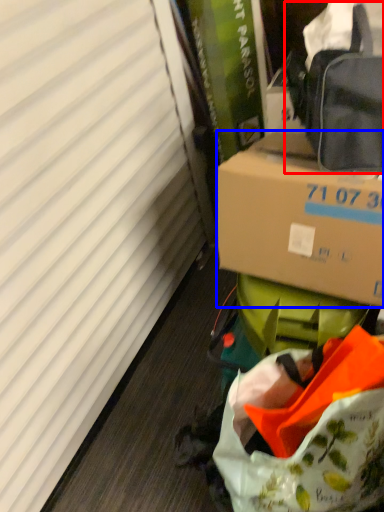
Question: Which object is further to the camera taking this photo, pack (highlighted by a red box) or box (highlighted by a blue box)?

Choices:
 (A) pack
 (B) box

Answer: (B)